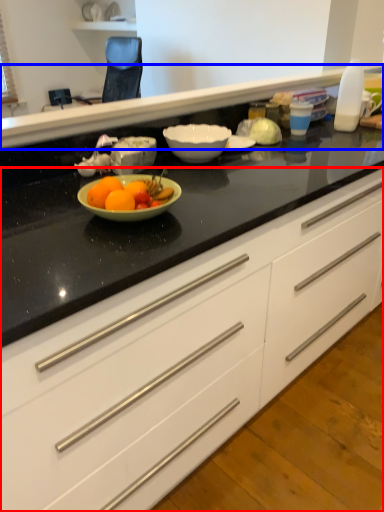
Question: Among these objects, which one is nearest to the camera, cabinetry (highlighted by a red box) or counter top (highlighted by a blue box)?

Choices:
 (A) cabinetry
 (B) counter top

Answer: (A)